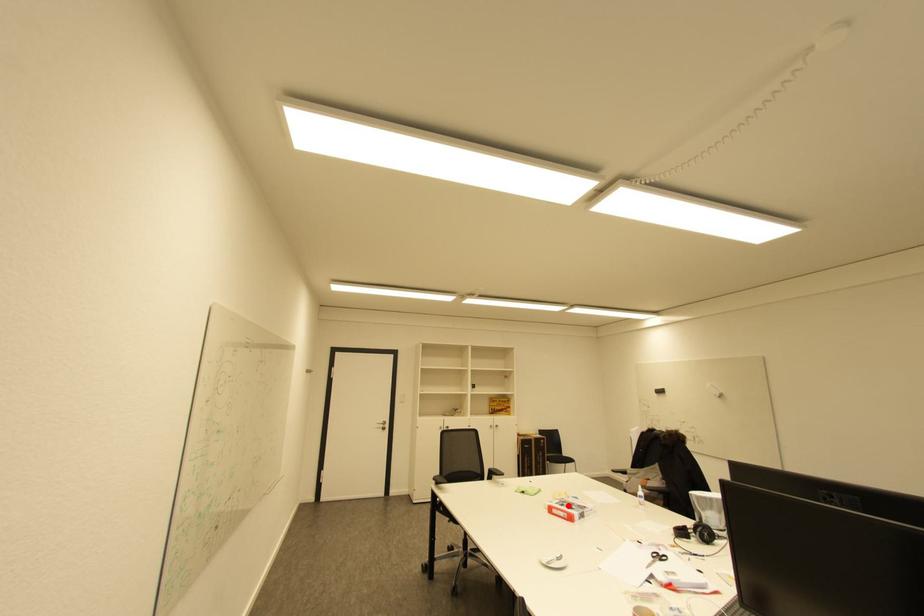
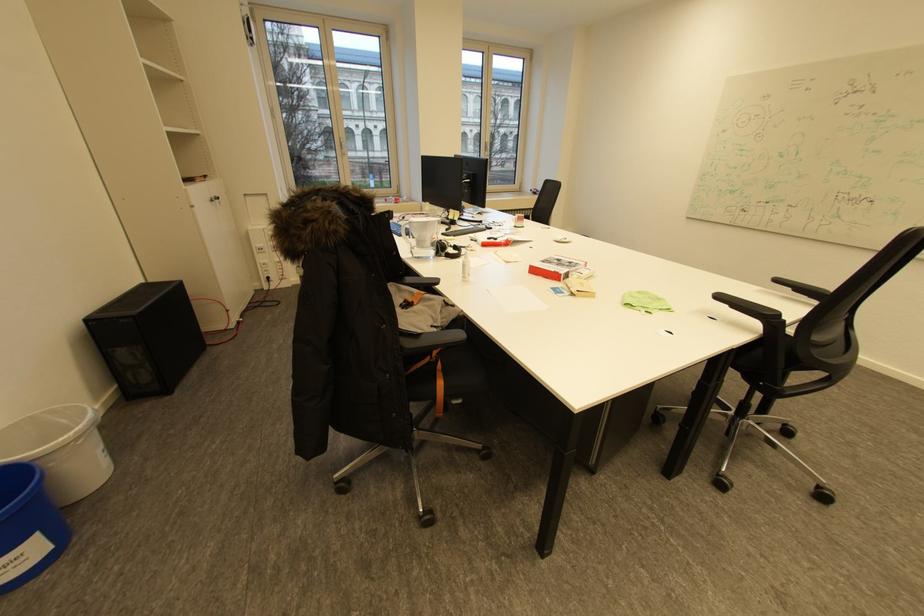
Question: I am providing you with two images of the same scene from different viewpoints. Image1 has a red point marked. In image2, the corresponding 3D location appears at what relative position? Reply with the corresponding letter.

Choices:
 (A) Closer
 (B) Farther

Answer: (B)